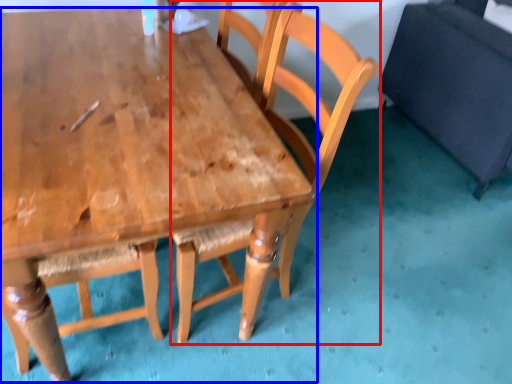
Question: Which point is further to the camera, chair (highlighted by a red box) or table (highlighted by a blue box)?

Choices:
 (A) chair
 (B) table

Answer: (A)